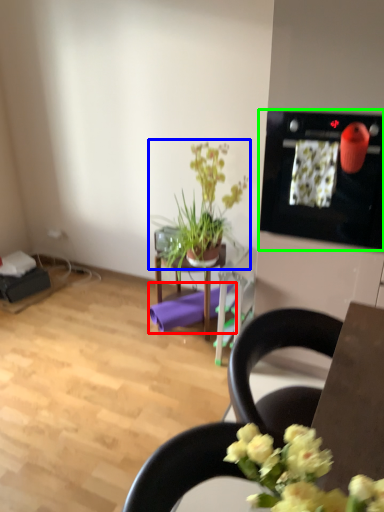
Question: Which is nearer to the yoga mat (highlighted by a red box)? houseplant (highlighted by a blue box) or appliance (highlighted by a green box).

Choices:
 (A) houseplant
 (B) appliance

Answer: (A)